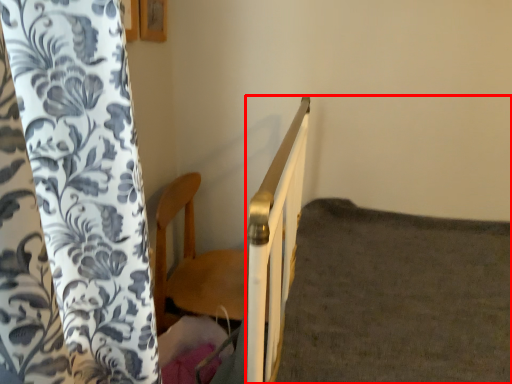
Question: In this image, where is bed frame (annotated by the red box) located relative to furniture?

Choices:
 (A) right
 (B) left

Answer: (A)